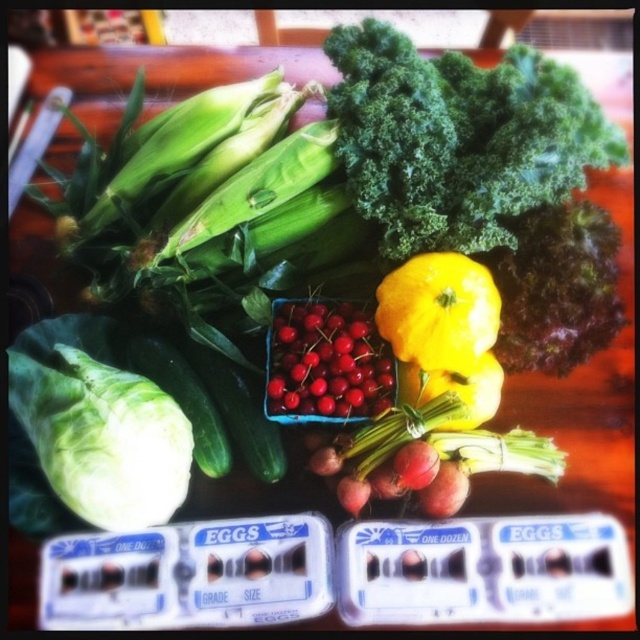
Question: Which point is farther to the camera?

Choices:
 (A) green leafy at upper center
 (B) green leafy at left
 (C) yellow matte squash at center
 (D) shiny red berries at center

Answer: (D)

Question: Can you confirm if green leafy at left is thinner than yellow matte squash at center?

Choices:
 (A) no
 (B) yes

Answer: (A)

Question: Which point is farther to the camera?

Choices:
 (A) (444, 305)
 (B) (19, 400)

Answer: (B)

Question: Can you confirm if green leafy at left is positioned above shiny red berries at center?

Choices:
 (A) yes
 (B) no

Answer: (B)

Question: In this image, where is shiny red berries at center located relative to yellow matte squash at center?

Choices:
 (A) above
 (B) below

Answer: (B)

Question: Which point appears closest to the camera in this image?

Choices:
 (A) [x=275, y=349]
 (B) [x=508, y=60]
 (C) [x=403, y=276]

Answer: (C)